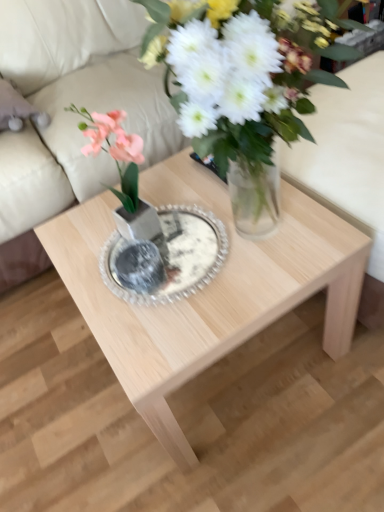
This screenshot has height=512, width=384. Identify the location of vacant area situated below natural wood coffee table at center (from a real-world perspective). (243, 368).